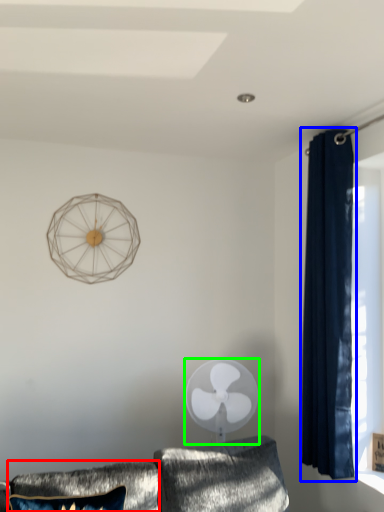
Question: Considering the real-world distances, which object is farthest from pillow (highlighted by a red box)? curtain (highlighted by a blue box) or mechanical fan (highlighted by a green box)?

Choices:
 (A) curtain
 (B) mechanical fan

Answer: (A)